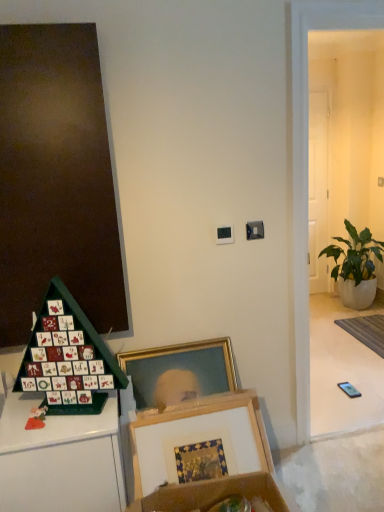
Locate an element on the screen. wooden picture frame at lower center is located at coordinates [x=198, y=438].

What do you see at coordinates (355, 266) in the screenshot? I see `green leafy plant in white pot at right` at bounding box center [355, 266].

At what (x,y) coordinates should I click in order to perform the action: click on gray woven mat at lower right. Please return your answer as a coordinate pair (x, y). Image resolution: width=384 pixels, height=512 pixels. Looking at the image, I should click on (366, 331).

Locate an element on the screen. The width and height of the screenshot is (384, 512). green cardboard advent calendar at lower left is located at coordinates (67, 354).

Describe the element at coordinates (318, 191) in the screenshot. Image resolution: width=384 pixels, height=512 pixels. I see `white glossy door at right` at that location.

In order to click on wooden picture frame at lower center in this screenshot , I will do `click(198, 438)`.

Considering the relative positions of white glossy door at right and green cardboard advent calendar at lower left in the image provided, is white glossy door at right to the right of green cardboard advent calendar at lower left from the viewer's perspective?

Correct, you'll find white glossy door at right to the right of green cardboard advent calendar at lower left.

Could green cardboard advent calendar at lower left be considered to be inside white glossy door at right?

No, green cardboard advent calendar at lower left is not surrounded by white glossy door at right.

Is white glossy door at right taller or shorter than green cardboard advent calendar at lower left?

Clearly, white glossy door at right is taller compared to green cardboard advent calendar at lower left.

From a real-world perspective, is white glossy door at right physically below green cardboard advent calendar at lower left?

Incorrect, from a real-world perspective, white glossy door at right is higher than green cardboard advent calendar at lower left.

From the image's perspective, is wooden picture frame at lower center located beneath gray woven mat at lower right?

Yes.

Between wooden picture frame at lower center and gray woven mat at lower right, which one has smaller size?

gray woven mat at lower right is smaller.

Is point (154, 467) closer to viewer compared to point (374, 315)?

That is True.

This screenshot has height=512, width=384. What are the coordinates of `picture frame to the left of gray woven mat at lower right` in the screenshot? It's located at (198, 438).

Is gray woven mat at lower right oriented away from green leafy plant in white pot at right?

No, gray woven mat at lower right's orientation is not away from green leafy plant in white pot at right.

Which object is further away from the camera, gray woven mat at lower right or green leafy plant in white pot at right?

green leafy plant in white pot at right is further from the camera.

How distant is gray woven mat at lower right from green leafy plant in white pot at right?

gray woven mat at lower right is 17.22 inches from green leafy plant in white pot at right.

Is gray woven mat at lower right not close to green leafy plant in white pot at right?

They are positioned close to each other.

Identify the location of mat in front of the white glossy door at right. (366, 331).

How much distance is there between white glossy door at right and gray woven mat at lower right?

white glossy door at right and gray woven mat at lower right are 1.12 meters apart.

Which point is more distant from viewer, (316, 108) or (374, 329)?

The point (316, 108) is farther.

Which object is thinner, white glossy door at right or gray woven mat at lower right?

With smaller width is white glossy door at right.

Is green cardboard advent calendar at lower left facing towards white glossy door at right?

No, green cardboard advent calendar at lower left is not turned towards white glossy door at right.

Which is nearer, [54,347] or [323,160]?

The point [54,347] is closer to the camera.

Considering the positions of objects green cardboard advent calendar at lower left and white glossy door at right in the image provided, who is behind, green cardboard advent calendar at lower left or white glossy door at right?

white glossy door at right is behind.

Is green leafy plant in white pot at right placed right next to green cardboard advent calendar at lower left?

No, green leafy plant in white pot at right is not beside green cardboard advent calendar at lower left.

The height and width of the screenshot is (512, 384). What are the coordinates of `toy located above the green leafy plant in white pot at right (from a real-world perspective)` in the screenshot? It's located at (67, 354).

From a real-world perspective, does green leafy plant in white pot at right stand above green cardboard advent calendar at lower left?

No, from a real-world perspective, green leafy plant in white pot at right is not on top of green cardboard advent calendar at lower left.

Considering the relative sizes of green leafy plant in white pot at right and gray woven mat at lower right in the image provided, is green leafy plant in white pot at right wider than gray woven mat at lower right?

Yes.

Looking at this image, from a real-world perspective, is green leafy plant in white pot at right located higher than gray woven mat at lower right?

Correct, in the physical world, green leafy plant in white pot at right is higher than gray woven mat at lower right.

Considering the sizes of green leafy plant in white pot at right and gray woven mat at lower right in the image, is green leafy plant in white pot at right bigger or smaller than gray woven mat at lower right?

green leafy plant in white pot at right is bigger than gray woven mat at lower right.

Locate an element on the screen. toy lying in front of the white glossy door at right is located at coordinates (67, 354).

Image resolution: width=384 pixels, height=512 pixels. What are the coordinates of `picture frame above the gray woven mat at lower right (from a real-world perspective)` in the screenshot? It's located at (198, 438).

Looking at the image, which one is located further to wooden picture frame at lower center, gray woven mat at lower right or white glossy door at right?

white glossy door at right.

When comparing their distances from gray woven mat at lower right, does green cardboard advent calendar at lower left or white glossy door at right seem further?

A: green cardboard advent calendar at lower left is positioned further to the anchor gray woven mat at lower right.

When comparing their distances from green cardboard advent calendar at lower left, does gray woven mat at lower right or wooden picture frame at lower center seem closer?

wooden picture frame at lower center is closer to green cardboard advent calendar at lower left.

Estimate the real-world distances between objects in this image. Which object is further from white glossy door at right, gray woven mat at lower right or green leafy plant in white pot at right?

gray woven mat at lower right is positioned further to the anchor white glossy door at right.

From the picture: From the image, which object appears to be farther from white glossy door at right, wooden picture frame at lower center or green cardboard advent calendar at lower left?

Among the two, green cardboard advent calendar at lower left is located further to white glossy door at right.

From the image, which object appears to be farther from green cardboard advent calendar at lower left, green leafy plant in white pot at right or gray woven mat at lower right?

Based on the image, green leafy plant in white pot at right appears to be further to green cardboard advent calendar at lower left.

Which object lies nearer to the anchor point wooden picture frame at lower center, green cardboard advent calendar at lower left or white glossy door at right?

green cardboard advent calendar at lower left.

Looking at the image, which one is located closer to gray woven mat at lower right, white glossy door at right or green cardboard advent calendar at lower left?

Among the two, white glossy door at right is located nearer to gray woven mat at lower right.

At what (x,y) coordinates should I click in order to perform the action: click on mat between wooden picture frame at lower center and green leafy plant in white pot at right in the front-back direction. Please return your answer as a coordinate pair (x, y). Looking at the image, I should click on (366, 331).

At what (x,y) coordinates should I click in order to perform the action: click on mat positioned between green cardboard advent calendar at lower left and white glossy door at right from near to far. Please return your answer as a coordinate pair (x, y). This screenshot has width=384, height=512. Looking at the image, I should click on (366, 331).

This screenshot has height=512, width=384. What are the coordinates of `houseplant between wooden picture frame at lower center and white glossy door at right from front to back` in the screenshot? It's located at (355, 266).

Locate an element on the screen. mat located between green cardboard advent calendar at lower left and green leafy plant in white pot at right in the depth direction is located at coordinates (366, 331).